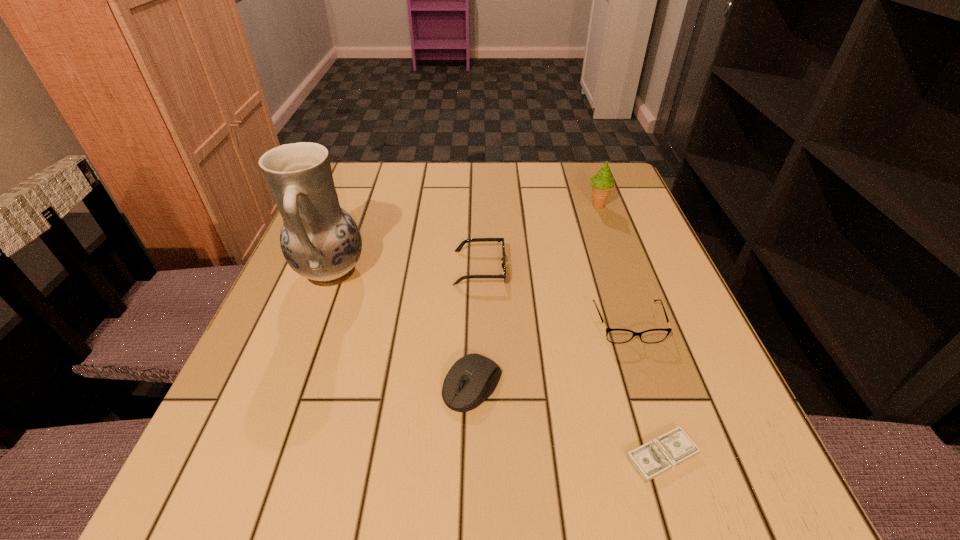
Where is `free space located 0.240m on the front of the icecream`? This screenshot has height=540, width=960. free space located 0.240m on the front of the icecream is located at coordinates (625, 280).

Where is `vacant space located on the front-facing side of the sunglasses`? The image size is (960, 540). vacant space located on the front-facing side of the sunglasses is located at coordinates (584, 268).

Image resolution: width=960 pixels, height=540 pixels. Identify the location of vacant space situated 0.200m on the front-facing side of the spectacles. (672, 456).

Locate an element on the screen. This screenshot has height=540, width=960. free region located on the back of the computer equipment is located at coordinates (474, 257).

This screenshot has width=960, height=540. Find the location of `blank area located 0.090m on the back of the money`. blank area located 0.090m on the back of the money is located at coordinates (637, 379).

Identify the location of object that is at the far edge. This screenshot has height=540, width=960. (602, 183).

Where is `object situated at the near edge`? The width and height of the screenshot is (960, 540). object situated at the near edge is located at coordinates (652, 459).

I want to click on object that is at the left edge, so click(320, 241).

Find the location of `icecream that is at the right edge`. icecream that is at the right edge is located at coordinates (602, 183).

This screenshot has width=960, height=540. Identify the location of spectacles that is at the right edge. (617, 336).